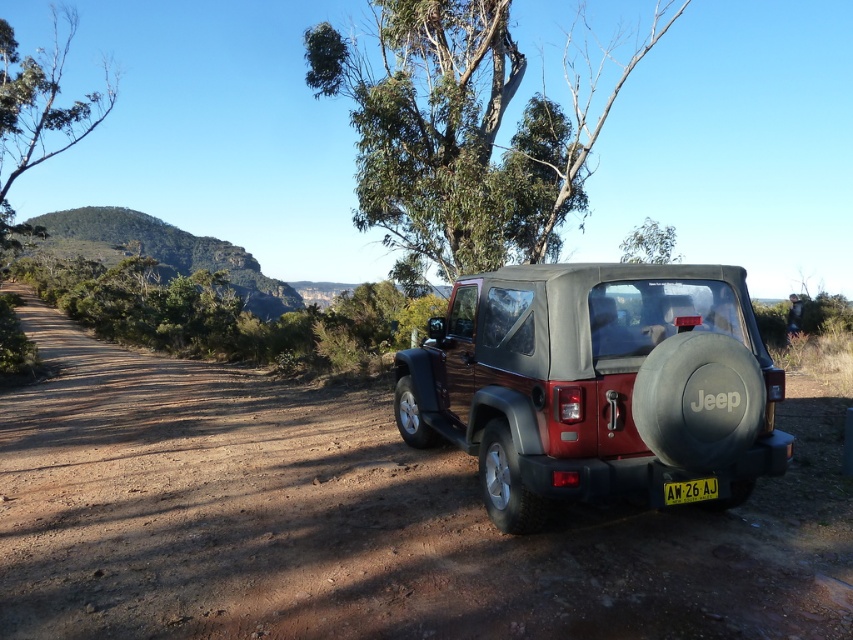
Question: Is dirt field at center further to camera compared to matte black jeep at right?

Choices:
 (A) no
 (B) yes

Answer: (A)

Question: Is the position of dirt field at center less distant than that of matte black jeep at right?

Choices:
 (A) yes
 (B) no

Answer: (A)

Question: Is dirt field at center in front of matte black jeep at right?

Choices:
 (A) no
 (B) yes

Answer: (B)

Question: Considering the real-world distances, which object is farthest from the green leafy tree at left?

Choices:
 (A) dirt field at center
 (B) green leafy tree at upper center

Answer: (B)

Question: Which point is closer to the camera taking this photo?

Choices:
 (A) (440, 132)
 (B) (201, 500)
 (C) (714, 445)

Answer: (C)

Question: Which object appears closest to the camera in this image?

Choices:
 (A) dirt field at center
 (B) matte black jeep at right

Answer: (A)